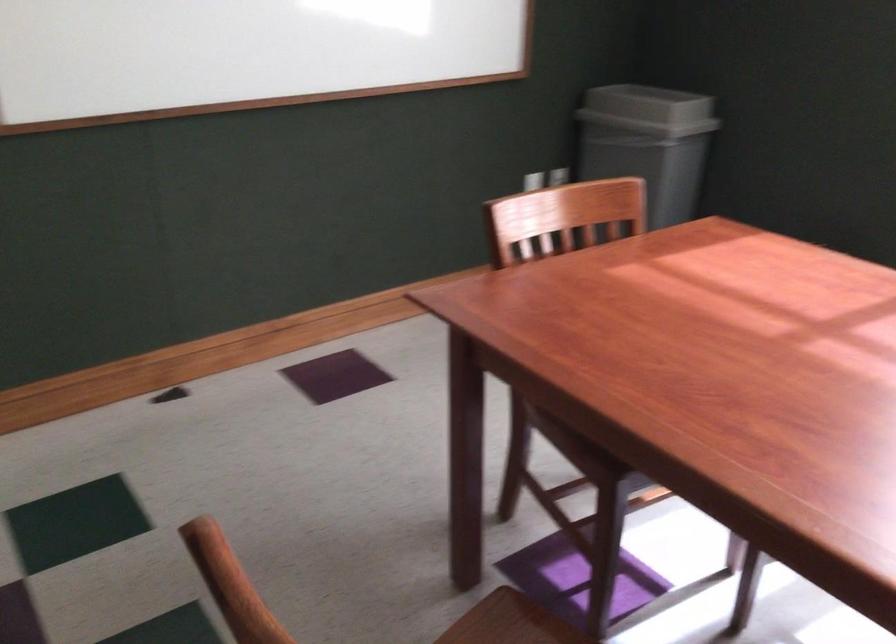
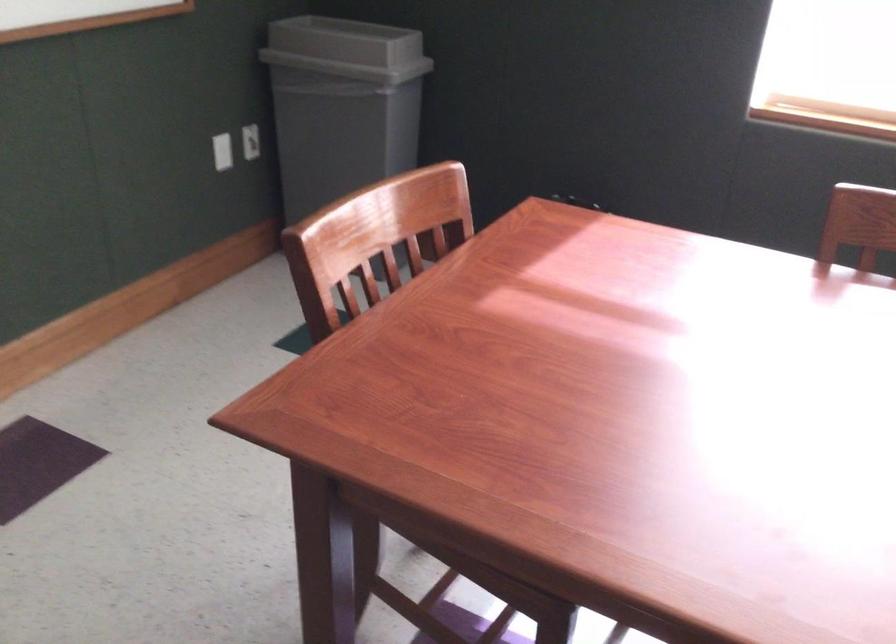
Question: The images are taken continuously from a first-person perspective. In which direction are you moving?

Choices:
 (A) Left
 (B) Right
 (C) Forward
 (D) Backward

Answer: (C)